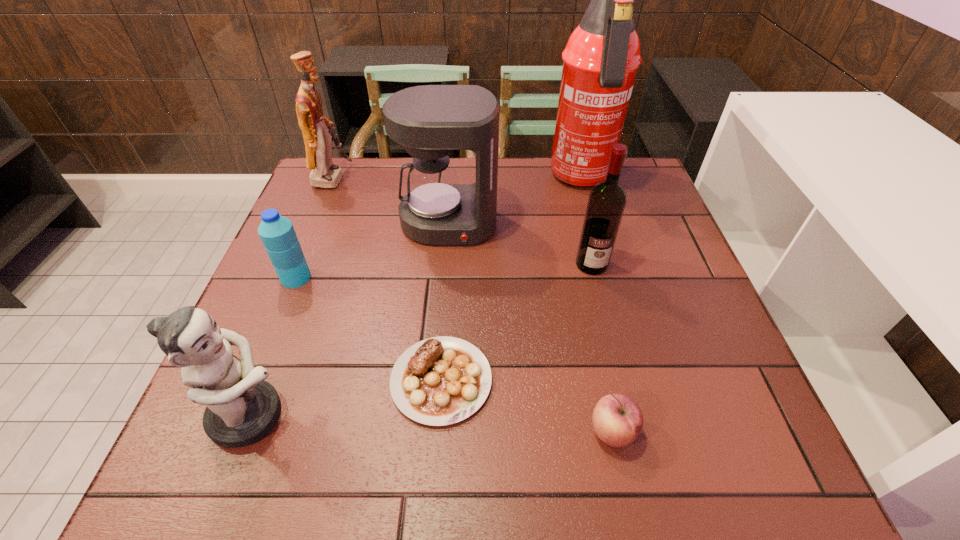
Find the location of a particular element. The width and height of the screenshot is (960, 540). vacant space located 0.060m on the button side of the coffee maker is located at coordinates (445, 265).

This screenshot has width=960, height=540. What are the coordinates of `vacant area situated 0.240m on the front and back of the alcohol` in the screenshot? It's located at pos(616,364).

The height and width of the screenshot is (540, 960). I want to click on vacant area situated on the front-facing side of the figurine, so click(x=466, y=415).

In order to click on vacant space situated 0.150m on the back of the water bottle in this screenshot , I will do [317, 227].

At what (x,y) coordinates should I click in order to perform the action: click on free space located 0.290m on the back of the apple. Please return your answer as a coordinate pair (x, y). The width and height of the screenshot is (960, 540). Looking at the image, I should click on (582, 291).

Where is `free location located 0.230m on the left of the steak`? This screenshot has width=960, height=540. free location located 0.230m on the left of the steak is located at coordinates pyautogui.click(x=270, y=380).

Locate an element on the screen. fire extinguisher at the far edge is located at coordinates (600, 61).

Where is `nutcracker located in the far edge section of the desktop`? This screenshot has height=540, width=960. nutcracker located in the far edge section of the desktop is located at coordinates tap(318, 144).

Locate an element on the screen. The height and width of the screenshot is (540, 960). coffee maker that is at the far edge is located at coordinates (430, 121).

Where is `figurine that is at the near edge`? The height and width of the screenshot is (540, 960). figurine that is at the near edge is located at coordinates (241, 409).